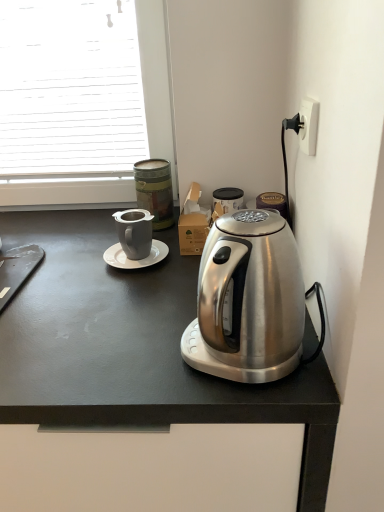
Where is `satin silver kettle at right`? The image size is (384, 512). satin silver kettle at right is located at coordinates (250, 301).

Describe the element at coordinates (135, 260) in the screenshot. The height and width of the screenshot is (512, 384). I see `white glossy saucer at center` at that location.

Find the location of a particular element. The image size is (384, 512). white glossy saucer at center is located at coordinates (135, 260).

The width and height of the screenshot is (384, 512). I want to click on satin silver kettle at right, so click(x=250, y=301).

In terms of height, does white glossy saucer at center look taller or shorter compared to white plastic power outlet at upper right?

In the image, white glossy saucer at center appears to be shorter than white plastic power outlet at upper right.

Where is `power outlet above the white glossy saucer at center (from a real-world perspective)`? This screenshot has width=384, height=512. power outlet above the white glossy saucer at center (from a real-world perspective) is located at coordinates (308, 125).

Between white glossy saucer at center and white plastic power outlet at upper right, which one appears on the right side from the viewer's perspective?

Positioned to the right is white plastic power outlet at upper right.

Consider the image. From the image's perspective, between white glossy saucer at center and white plastic power outlet at upper right, who is located below?

From the image's view, white glossy saucer at center is below.

Based on the photo, from the image's perspective, is matte gray mug at center-left located beneath satin silver kettle at right?

No, from the image's perspective, matte gray mug at center-left is not beneath satin silver kettle at right.

The width and height of the screenshot is (384, 512). I want to click on coffee cup on the left side of satin silver kettle at right, so click(x=134, y=232).

Is matte gray mug at center-left wider or thinner than satin silver kettle at right?

In the image, matte gray mug at center-left appears to be more narrow than satin silver kettle at right.

From their relative heights in the image, would you say satin silver kettle at center is taller or shorter than matte gray mug at center-left?

satin silver kettle at center is taller than matte gray mug at center-left.

Is satin silver kettle at center to the right of matte gray mug at center-left from the viewer's perspective?

In fact, satin silver kettle at center is to the left of matte gray mug at center-left.

Between satin silver kettle at center and matte gray mug at center-left, which one is positioned behind?

matte gray mug at center-left is further from the camera.

Are satin silver kettle at center and matte gray mug at center-left located far from each other?

No, satin silver kettle at center is not far away from matte gray mug at center-left.

Which is more to the left, satin silver kettle at right or white glossy saucer at center?

white glossy saucer at center.

Is satin silver kettle at right positioned with its back to white glossy saucer at center?

That's not correct — satin silver kettle at right is not looking away from white glossy saucer at center.

Is point (235, 280) closer or farther from the camera than point (152, 249)?

Point (235, 280) is closer to the camera than point (152, 249).

In the image, is satin silver kettle at right positioned in front of or behind white glossy saucer at center?

satin silver kettle at right is in front of white glossy saucer at center.

Where is `desk on the left of matte gray mug at center-left`? The image size is (384, 512). desk on the left of matte gray mug at center-left is located at coordinates (135, 348).

Can you confirm if matte gray mug at center-left is positioned to the right of satin silver kettle at center?

Yes, matte gray mug at center-left is to the right of satin silver kettle at center.

From the image's perspective, which is below, matte gray mug at center-left or satin silver kettle at center?

From the image's view, satin silver kettle at center is below.

Considering the relative positions of matte gray mug at center-left and satin silver kettle at center in the image provided, is matte gray mug at center-left behind satin silver kettle at center?

Yes, it is behind satin silver kettle at center.

From a real-world perspective, which object stands above the other?

satin silver kettle at right, from a real-world perspective.

Which is more distant, (153,250) or (276,318)?

The point (153,250) is farther from the camera.

Is satin silver kettle at right inside white glossy saucer at center?

That's incorrect, satin silver kettle at right is not inside white glossy saucer at center.

Between white plastic power outlet at upper right and satin silver kettle at center, which one has less height?

With less height is white plastic power outlet at upper right.

What's the angular difference between white plastic power outlet at upper right and satin silver kettle at center's facing directions?

There is a 89.9-degree angle between the facing directions of white plastic power outlet at upper right and satin silver kettle at center.

From a real-world perspective, which object stands above the other?

In real-world perspective, white plastic power outlet at upper right is above.

Is white plastic power outlet at upper right spatially inside satin silver kettle at center, or outside of it?

white plastic power outlet at upper right is outside satin silver kettle at center.

Identify the location of power outlet in front of the white glossy saucer at center. (308, 125).

I want to click on coffee maker that is on the right side of matte gray mug at center-left, so click(x=250, y=301).

From the image, which object appears to be nearer to white plastic power outlet at upper right, satin silver kettle at center or matte gray mug at center-left?

matte gray mug at center-left lies closer to white plastic power outlet at upper right than the other object.

Considering their positions, is satin silver kettle at center positioned further to white plastic power outlet at upper right than matte gray mug at upper center?

satin silver kettle at center.

Looking at the image, which one is located further to satin silver kettle at right, white plastic power outlet at upper right or matte gray mug at upper center?

matte gray mug at upper center.

Estimate the real-world distances between objects in this image. Which object is further from matte gray mug at center-left, matte gray mug at upper center or white plastic power outlet at upper right?

Among the two, white plastic power outlet at upper right is located further to matte gray mug at center-left.

Looking at the image, which one is located further to white plastic power outlet at upper right, white glossy saucer at center or satin silver kettle at right?

Based on the image, white glossy saucer at center appears to be further to white plastic power outlet at upper right.

From the image, which object appears to be nearer to matte gray mug at upper center, matte gray mug at center-left or white plastic power outlet at upper right?

Among the two, matte gray mug at center-left is located nearer to matte gray mug at upper center.

Considering their positions, is satin silver kettle at right positioned further to satin silver kettle at center than white plastic power outlet at upper right?

Among the two, white plastic power outlet at upper right is located further to satin silver kettle at center.

Based on their spatial positions, is white plastic power outlet at upper right or matte gray mug at upper center closer to satin silver kettle at center?

matte gray mug at upper center is closer to satin silver kettle at center.

This screenshot has height=512, width=384. I want to click on appliance between white plastic power outlet at upper right and satin silver kettle at center from top to bottom, so click(155, 191).

I want to click on saucer between white plastic power outlet at upper right and matte gray mug at upper center in the front-back direction, so click(x=135, y=260).

You are a GUI agent. You are given a task and a screenshot of the screen. Output one action in this format:
    pyautogui.click(x=<x>, y=<y>)
    Task: Click on the coffee cup between matte gray mug at upper center and white glossy saucer at center in the vertical direction
    The width and height of the screenshot is (384, 512).
    Given the screenshot: What is the action you would take?
    pyautogui.click(x=134, y=232)

I want to click on saucer between satin silver kettle at right and matte gray mug at upper center from front to back, so click(x=135, y=260).